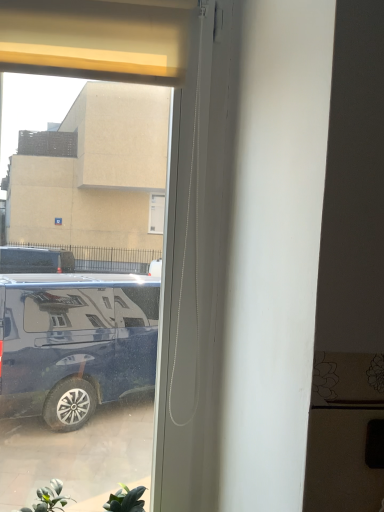
This screenshot has height=512, width=384. I want to click on transparent glass window at center, so click(x=98, y=38).

Describe the element at coordinates (98, 38) in the screenshot. This screenshot has width=384, height=512. I see `transparent glass window at center` at that location.

At what (x,y) coordinates should I click in order to perform the action: click on transparent glass window at center. Please return your answer as a coordinate pair (x, y). This screenshot has height=512, width=384. Looking at the image, I should click on (98, 38).